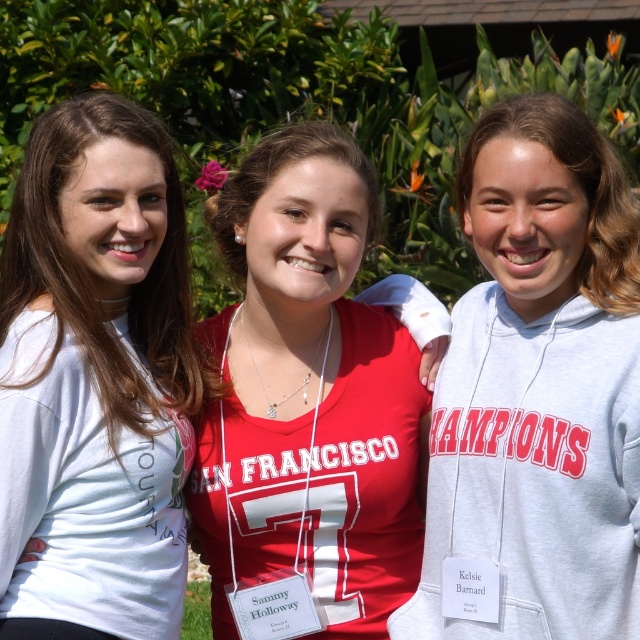
You are a photographer trying to capture a clear shot of the white matte shirt at center and the gray fleece sweatshirt at center. Based on their positions, which one is closer to the camera?

The white matte shirt at center is located below the gray fleece sweatshirt at center, meaning the gray fleece sweatshirt at center is closer to the camera.

You are organizing a photo shoot and need to ensure that all participants are visible in the frame. Given that the white matte shirt at center and the gray fleece sweatshirt at center are both in the center of the image, which clothing item will appear more prominent to the camera?

The white matte shirt at center is larger in size than the gray fleece sweatshirt at center, so it will appear more prominent in the camera frame.

You are a photographer trying to capture a group photo of the two people wearing the white matte shirt at center and gray fleece sweatshirt at center. If your camera has a maximum focus range of 25 inches, will you be able to capture both subjects in focus without adjusting your position?

The white matte shirt at center and gray fleece sweatshirt at center are 26.56 inches apart from each other. Since the distance exceeds the camera maximum focus range of 25 inches, you will need to adjust your position to reduce the distance between them or move closer to ensure both are in focus.